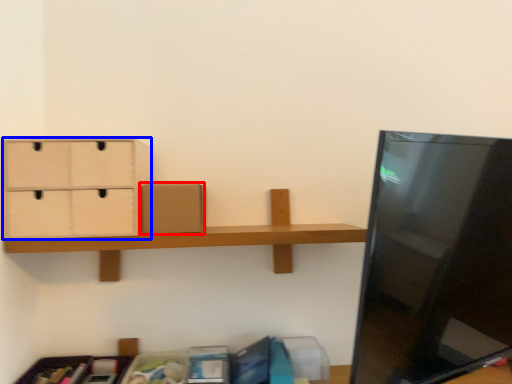
Question: Which object is closer to the camera taking this photo, cardboard box (highlighted by a red box) or drawer (highlighted by a blue box)?

Choices:
 (A) cardboard box
 (B) drawer

Answer: (B)